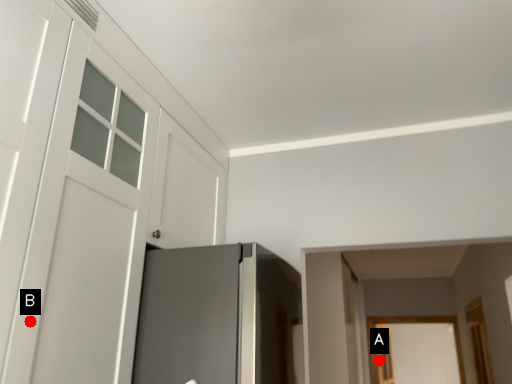
Question: Two points are circled on the image, labeled by A and B beside each circle. Which point is further to the camera?

Choices:
 (A) A is further
 (B) B is further

Answer: (A)